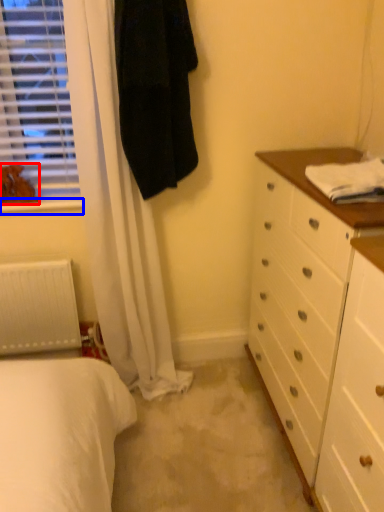
Question: Which point is further to the camera, animal (highlighted by a red box) or window sill (highlighted by a blue box)?

Choices:
 (A) animal
 (B) window sill

Answer: (B)